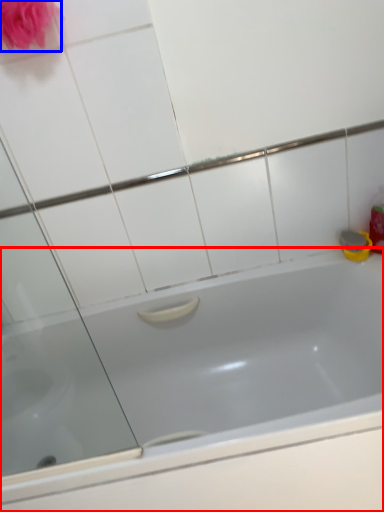
Question: Which object is further to the camera taking this photo, bathtub (highlighted by a red box) or rose (highlighted by a blue box)?

Choices:
 (A) bathtub
 (B) rose

Answer: (B)